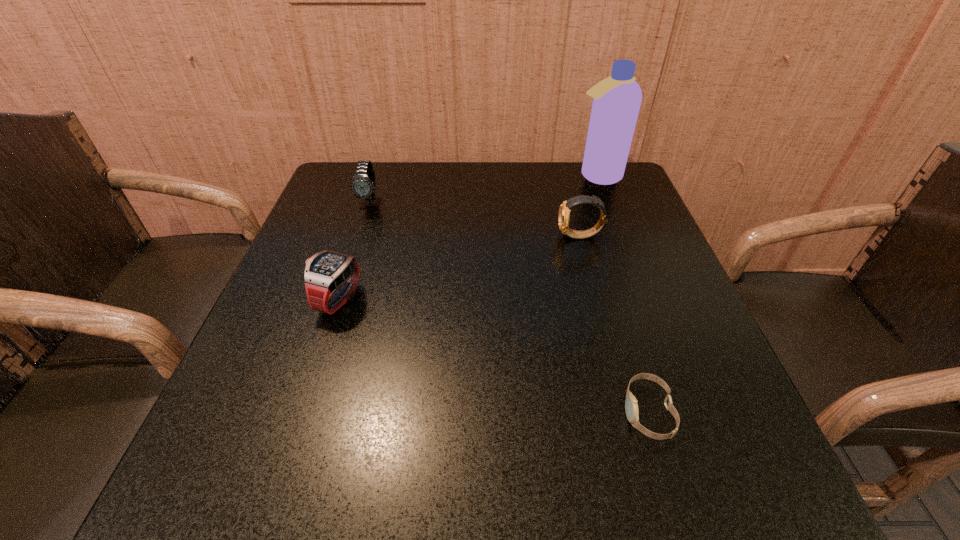
Where is `the tallest object`? the tallest object is located at coordinates (617, 99).

Find the location of a particular element. The width and height of the screenshot is (960, 540). the farthest object is located at coordinates (617, 99).

In order to click on the fourth nearest object in this screenshot , I will do `click(363, 185)`.

Image resolution: width=960 pixels, height=540 pixels. Find the location of `the second farthest watch`. the second farthest watch is located at coordinates (564, 211).

Image resolution: width=960 pixels, height=540 pixels. What are the coordinates of `the second nearest watch` in the screenshot? It's located at (330, 278).

Where is `the nearest object`? the nearest object is located at coordinates (631, 406).

Locate an element on the screen. the nearest watch is located at coordinates (631, 406).

I want to click on vacant space located on the left of the tallest object, so click(x=426, y=176).

This screenshot has height=540, width=960. Identify the location of blank space located 0.330m on the face of the fourth nearest object. (335, 315).

The width and height of the screenshot is (960, 540). I want to click on vacant region located 0.340m on the face of the third nearest object, so click(411, 237).